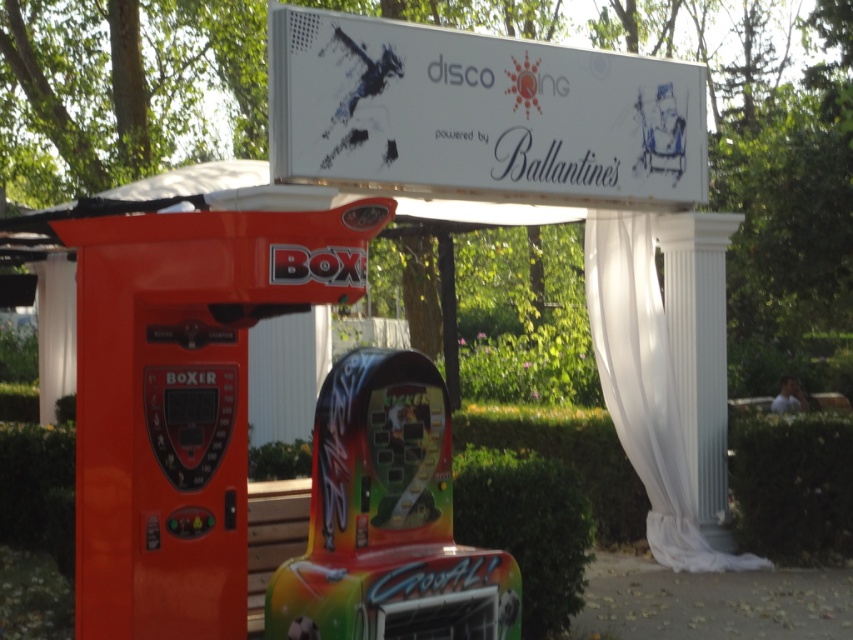
Does white glossy sign at upper center come in front of green leafy hedge at right?

Yes, it is.

Does white glossy sign at upper center appear over green leafy hedge at right?

Indeed, white glossy sign at upper center is positioned over green leafy hedge at right.

Between point (537, 157) and point (822, 508), which one is positioned in front?

Point (537, 157) is in front.

At what (x,y) coordinates should I click in order to perform the action: click on white glossy sign at upper center. Please return your answer as a coordinate pair (x, y). Looking at the image, I should click on (479, 115).

Is green leafy hedge at center closer to camera compared to green leafy hedge at right?

Yes, it is in front of green leafy hedge at right.

Between green leafy hedge at center and green leafy hedge at right, which one is positioned lower?

green leafy hedge at center is lower down.

Who is more distant from viewer, (560, 532) or (843, 436)?

The point (843, 436) is behind.

Where is `green leafy hedge at center`? green leafy hedge at center is located at coordinates [x=527, y=528].

Which is below, orange plastic vending machine at left or green leafy hedge at center?

Positioned lower is green leafy hedge at center.

Does point (210, 497) come closer to viewer compared to point (489, 456)?

Yes, point (210, 497) is in front of point (489, 456).

The height and width of the screenshot is (640, 853). I want to click on orange plastic vending machine at left, so click(183, 400).